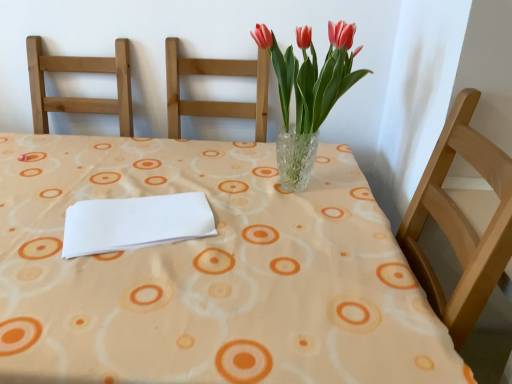
The width and height of the screenshot is (512, 384). What do you see at coordinates (208, 273) in the screenshot?
I see `clear glass vase at center` at bounding box center [208, 273].

This screenshot has height=384, width=512. What do you see at coordinates (308, 94) in the screenshot?
I see `translucent glass vase at center` at bounding box center [308, 94].

The height and width of the screenshot is (384, 512). I want to click on clear glass vase at center, so click(x=208, y=273).

Between white paper at center and translucent glass vase at center, which one appears on the left side from the viewer's perspective?

From the viewer's perspective, white paper at center appears more on the left side.

Considering the sizes of white paper at center and translucent glass vase at center in the image, is white paper at center bigger or smaller than translucent glass vase at center?

Considering their sizes, white paper at center takes up less space than translucent glass vase at center.

In the scene shown: Which of these two, white paper at center or translucent glass vase at center, is thinner?

With smaller width is translucent glass vase at center.

Based on the photo, which object is closer to the camera taking this photo, white paper at center or translucent glass vase at center?

white paper at center is closer to the camera.

Is translucent glass vase at center surrounding clear glass vase at center?

No, clear glass vase at center is not inside translucent glass vase at center.

Consider the image. From a real-world perspective, is translucent glass vase at center on top of clear glass vase at center?

Yes, from a real-world perspective, translucent glass vase at center is over clear glass vase at center

Is translucent glass vase at center touching clear glass vase at center?

translucent glass vase at center and clear glass vase at center are clearly separated.

Who is shorter, translucent glass vase at center or clear glass vase at center?

Standing shorter between the two is translucent glass vase at center.

Does clear glass vase at center come behind white paper at center?

No.

This screenshot has width=512, height=384. Find the location of `journal located above the clear glass vase at center (from a real-world perspective)`. journal located above the clear glass vase at center (from a real-world perspective) is located at coordinates (135, 223).

Who is bigger, clear glass vase at center or white paper at center?

clear glass vase at center.

How much distance is there between clear glass vase at center and white paper at center?

6.11 inches.

Is white paper at center thinner than clear glass vase at center?

Correct, the width of white paper at center is less than that of clear glass vase at center.

From a real-world perspective, which object stands above the other?

In real-world perspective, white paper at center is above.

From the image's perspective, which is above, white paper at center or clear glass vase at center?

From the image's view, white paper at center is above.

Which of these two, translucent glass vase at center or white paper at center, is bigger?

Bigger between the two is translucent glass vase at center.

You are a GUI agent. You are given a task and a screenshot of the screen. Output one action in this format:
    pyautogui.click(x=<x>, y=<y>)
    Task: Click on the journal lying in front of the translucent glass vase at center
    This screenshot has height=384, width=512.
    Given the screenshot: What is the action you would take?
    pyautogui.click(x=135, y=223)

In terms of height, does translucent glass vase at center look taller or shorter compared to white paper at center?

In the image, translucent glass vase at center appears to be taller than white paper at center.

Could you tell me if translucent glass vase at center is turned towards white paper at center?

No, translucent glass vase at center is not turned towards white paper at center.

Does point (32, 337) come behind point (292, 169)?

No, it is not.

Based on the photo, is clear glass vase at center not near translucent glass vase at center?

No, clear glass vase at center is in close proximity to translucent glass vase at center.

Considering the sizes of objects clear glass vase at center and translucent glass vase at center in the image provided, who is thinner, clear glass vase at center or translucent glass vase at center?

With smaller width is translucent glass vase at center.

At what (x,y) coordinates should I click in order to perform the action: click on floral arrangement above the white paper at center (from a real-world perspective). Please return your answer as a coordinate pair (x, y). The height and width of the screenshot is (384, 512). Looking at the image, I should click on (308, 94).

Locate an element on the screen. The width and height of the screenshot is (512, 384). table that appears below the translucent glass vase at center (from the image's perspective) is located at coordinates [208, 273].

Considering their positions, is clear glass vase at center positioned further to translucent glass vase at center than white paper at center?

white paper at center is further to translucent glass vase at center.

Estimate the real-world distances between objects in this image. Which object is further from white paper at center, translucent glass vase at center or clear glass vase at center?

translucent glass vase at center lies further to white paper at center than the other object.

Looking at the image, which one is located further to white paper at center, clear glass vase at center or translucent glass vase at center?

Among the two, translucent glass vase at center is located further to white paper at center.

Based on the photo, when comparing their distances from clear glass vase at center, does white paper at center or translucent glass vase at center seem further?

The object further to clear glass vase at center is translucent glass vase at center.

From the image, which object appears to be farther from clear glass vase at center, translucent glass vase at center or white paper at center?

translucent glass vase at center is positioned further to the anchor clear glass vase at center.

Considering their positions, is white paper at center positioned closer to translucent glass vase at center than clear glass vase at center?

clear glass vase at center is closer to translucent glass vase at center.

Find the location of a particular element. Image resolution: width=512 pixels, height=384 pixels. floral arrangement situated between white paper at center and clear glass vase at center from left to right is located at coordinates tap(308, 94).